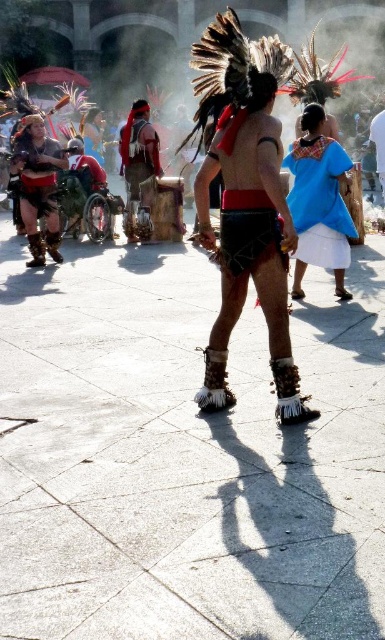
Question: Is leather moccasins at center further to the viewer compared to matte black shorts at left?

Choices:
 (A) no
 (B) yes

Answer: (A)

Question: Is leather moccasins at center to the right of blue cotton shirt at upper right from the viewer's perspective?

Choices:
 (A) yes
 (B) no

Answer: (B)

Question: Considering the real-world distances, which object is farthest from the red feather headdress at center?

Choices:
 (A) blue cotton shirt at upper right
 (B) leather moccasins at center

Answer: (B)

Question: Is leather moccasins at center above matte black shorts at left?

Choices:
 (A) yes
 (B) no

Answer: (B)

Question: Which of the following is the farthest from the observer?

Choices:
 (A) (267, 307)
 (B) (31, 163)
 (C) (155, 170)
 (D) (311, 154)

Answer: (C)

Question: Estimate the real-world distances between objects in this image. Which object is closer to the red feather headdress at center?

Choices:
 (A) matte black shorts at left
 (B) leather moccasins at center

Answer: (A)